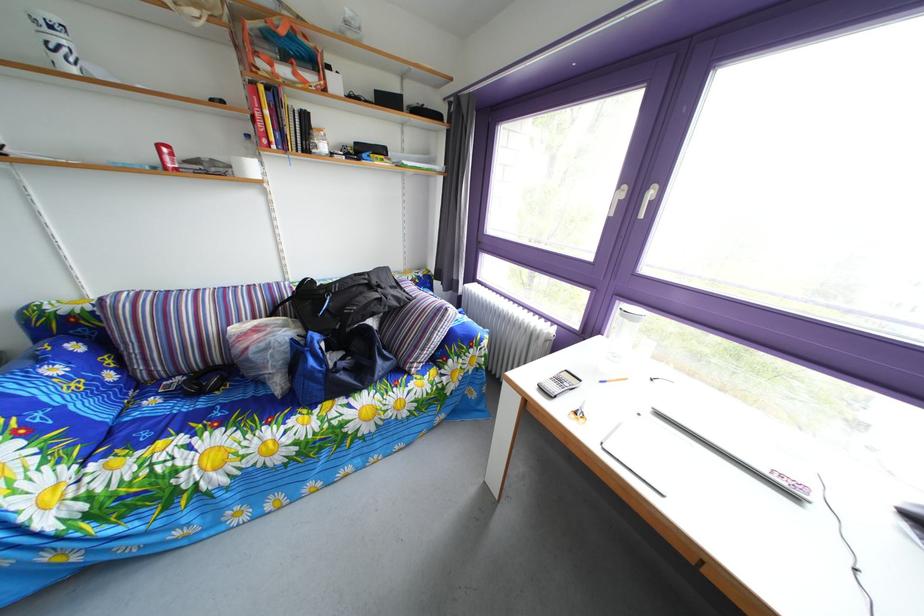
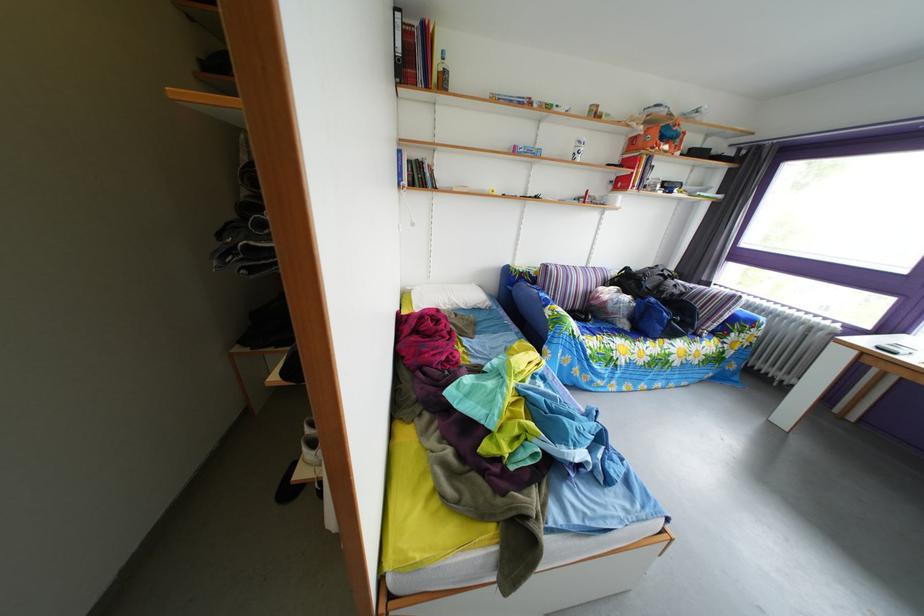
In the second image, find the point that corresponds to point 296,65 in the first image.

(673, 147)